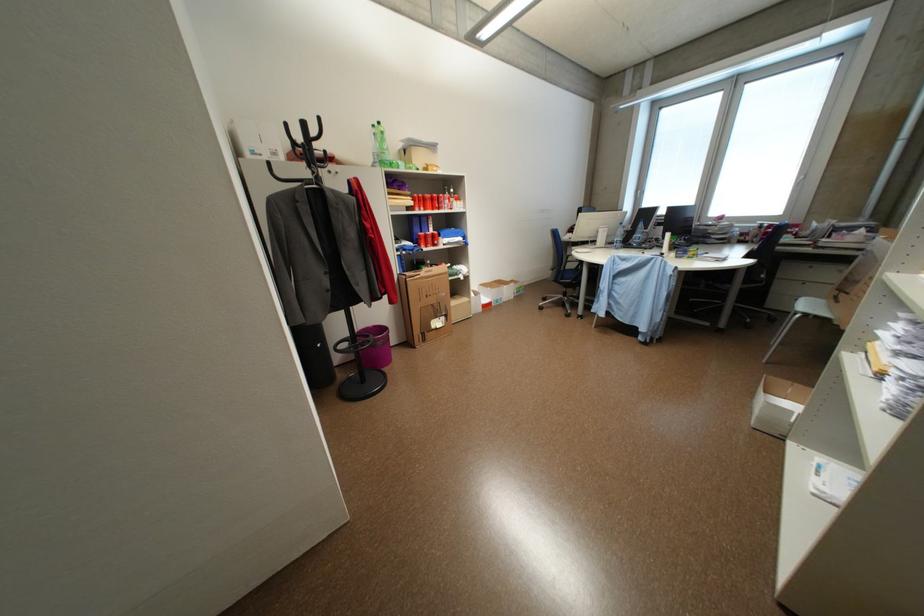
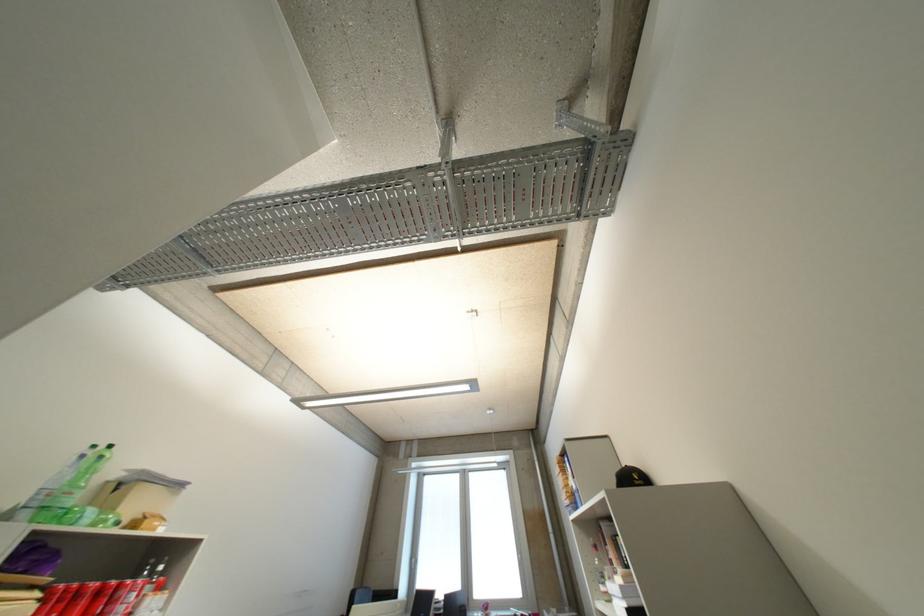
The first image is from the beginning of the video and the second image is from the end. How did the camera likely rotate when shooting the video?

The camera's rotation is toward right-up.